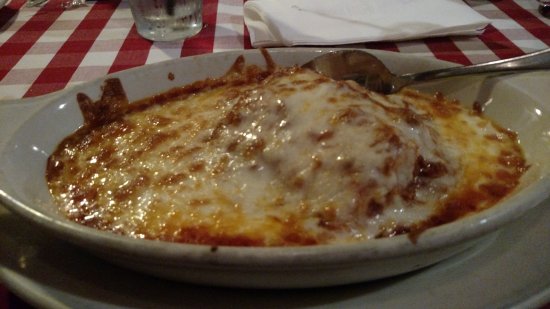
Locate an element on the screen. Image resolution: width=550 pixels, height=309 pixels. white dinner plate saucer is located at coordinates (490, 270).